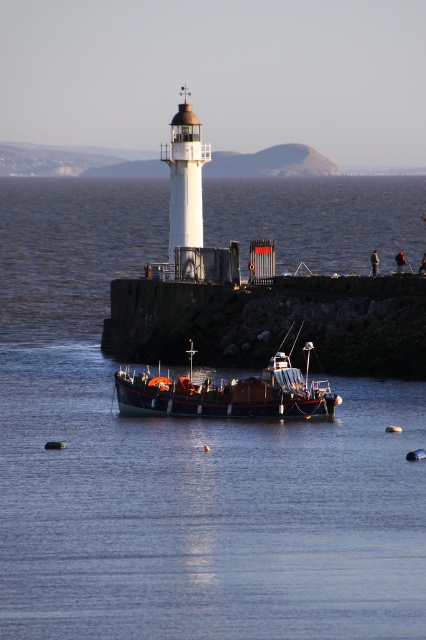
Does transparent water at center have a lesser width compared to wooden boat at center?

No, transparent water at center is not thinner than wooden boat at center.

Which is in front, point (123, 189) or point (207, 403)?

Positioned in front is point (207, 403).

Does point (65, 228) come closer to viewer compared to point (307, 413)?

No, (65, 228) is further to viewer.

What are the coordinates of `transparent water at center` in the screenshot? It's located at (181, 465).